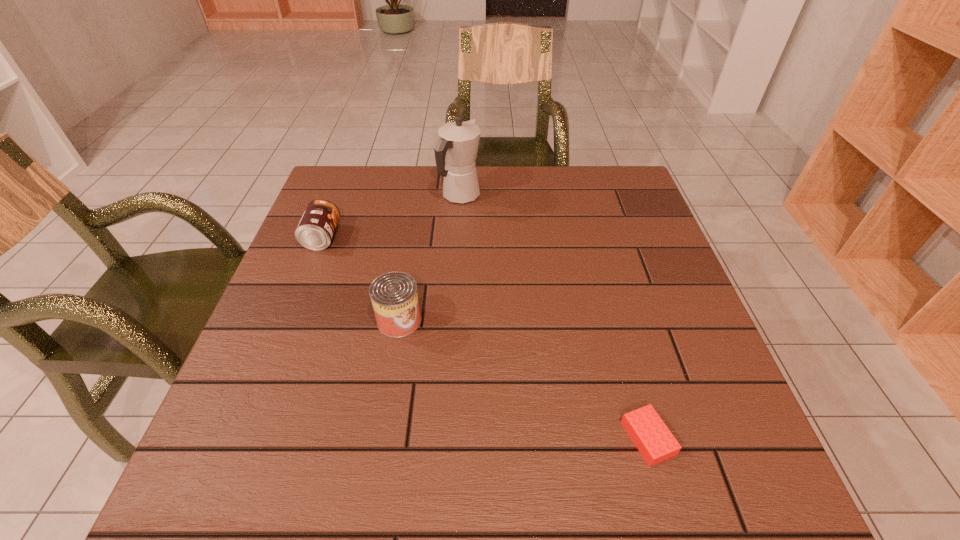
Image resolution: width=960 pixels, height=540 pixels. I want to click on free space that is in between the tallest object and the third object from right to left, so click(430, 258).

Image resolution: width=960 pixels, height=540 pixels. Identify the location of vacant region between the second shortest object and the nearest object. (485, 338).

The width and height of the screenshot is (960, 540). In order to click on vacant area between the coffeepot and the taller can in this screenshot , I will do `click(430, 258)`.

What are the coordinates of `object that can be found as the closest to the coffeepot` in the screenshot? It's located at (315, 230).

You are a GUI agent. You are given a task and a screenshot of the screen. Output one action in this format:
    pyautogui.click(x=<x>, y=<y>)
    Task: Click on the object that is the second nearest to the second object from right to left
    
    Given the screenshot: What is the action you would take?
    pyautogui.click(x=394, y=296)

I want to click on free space that satisfies the following two spatial constraints: 1. on the front label of the leftmost object; 2. on the left side of the rightmost object, so click(x=243, y=438).

The width and height of the screenshot is (960, 540). In order to click on vacant space that satisfies the following two spatial constraints: 1. on the back side of the second nearest object; 2. on the right side of the tallest object in this screenshot , I will do `click(420, 196)`.

The width and height of the screenshot is (960, 540). What are the coordinates of `vacant space that satisfies the following two spatial constraints: 1. on the front label of the second shortest object; 2. on the right side of the nearer can` in the screenshot? It's located at (290, 320).

The width and height of the screenshot is (960, 540). Find the location of `free space that satisfies the following two spatial constraints: 1. on the front label of the second farthest object; 2. on the left side of the nearer can`. free space that satisfies the following two spatial constraints: 1. on the front label of the second farthest object; 2. on the left side of the nearer can is located at coordinates (290, 320).

I want to click on free region that satisfies the following two spatial constraints: 1. on the front label of the farther can; 2. on the right side of the nearer can, so 290,320.